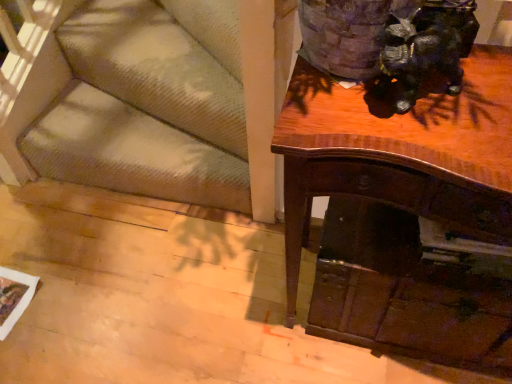
Where is `vacant area to the left of wooden drawer at lower right`? vacant area to the left of wooden drawer at lower right is located at coordinates (245, 300).